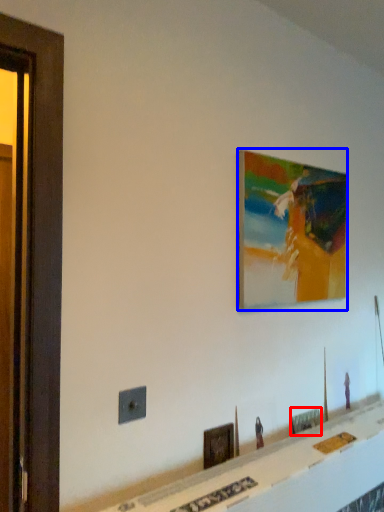
Question: Which of the following is the closest to the observer, picture frame (highlighted by a red box) or picture frame (highlighted by a blue box)?

Choices:
 (A) picture frame
 (B) picture frame

Answer: (B)